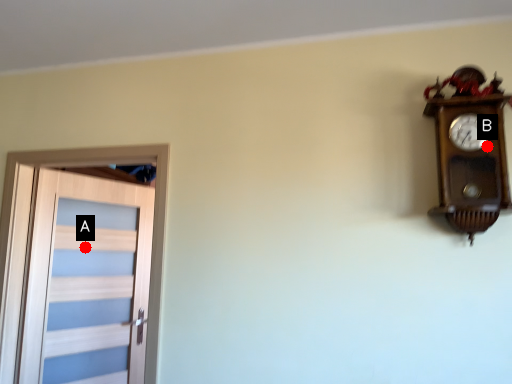
Question: Two points are circled on the image, labeled by A and B beside each circle. Which of the following is the closest to the observer?

Choices:
 (A) A is closer
 (B) B is closer

Answer: (B)